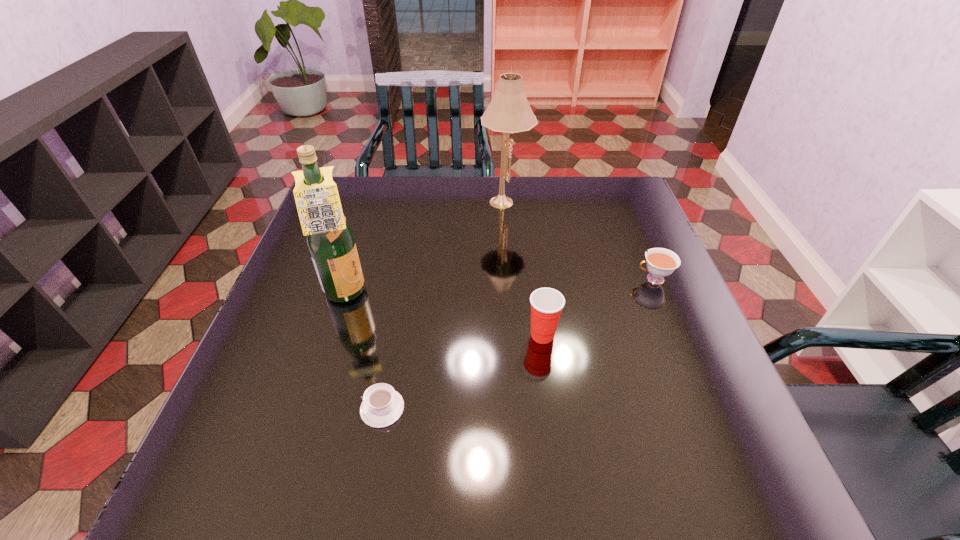
Where is `free spot located 0.320m on the front of the second nearest object`? free spot located 0.320m on the front of the second nearest object is located at coordinates (564, 503).

Where is `vacant space located on the side of the fourth tallest object with the handle`? The width and height of the screenshot is (960, 540). vacant space located on the side of the fourth tallest object with the handle is located at coordinates (575, 279).

Locate an element on the screen. This screenshot has width=960, height=540. free space located on the side of the fourth tallest object with the handle is located at coordinates tap(595, 279).

Image resolution: width=960 pixels, height=540 pixels. What are the coordinates of `vacant position located 0.140m on the side of the fourth tallest object with the handle` in the screenshot? It's located at (580, 279).

You are a GUI agent. You are given a task and a screenshot of the screen. Output one action in this format:
    pyautogui.click(x=<x>, y=<y>)
    Task: Click on the vacant space located 0.120m on the handle side of the nearest object
    
    Given the screenshot: What is the action you would take?
    pyautogui.click(x=299, y=408)

The width and height of the screenshot is (960, 540). In order to click on free space located on the handle side of the nearest object in this screenshot , I will do `click(262, 408)`.

I want to click on vacant area situated 0.190m on the handle side of the nearest object, so click(262, 408).

Where is `object present at the far edge`? This screenshot has height=540, width=960. object present at the far edge is located at coordinates (509, 112).

Identify the location of object positioned at the left edge. The height and width of the screenshot is (540, 960). (330, 240).

Identify the location of object located at the right edge. This screenshot has width=960, height=540. (661, 262).